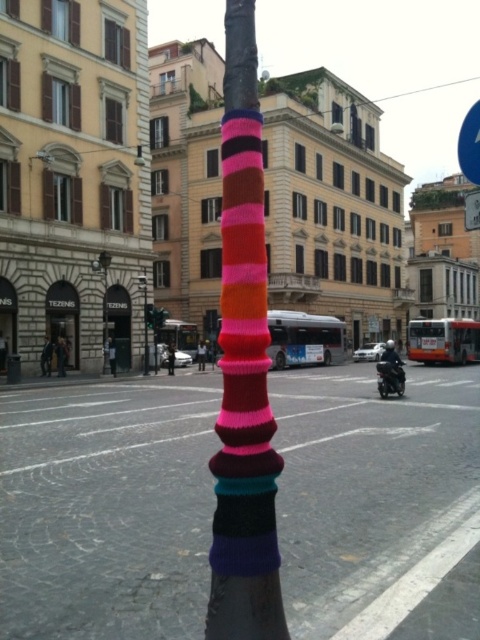
Consider the image. You are a delivery rider on a motorcycle that requires a minimum turning radius of 10 meters. You need to navigate around the metallic silver lamp post at center while staying on the same path as the shiny black motorcycle at center. Is your motorcycle able to make the turn without hitting the lamp post?

The distance between the shiny black motorcycle at center and the metallic silver lamp post at center is 16.54 meters. Since your motorcycle requires a minimum turning radius of 10 meters, the 16.54 meters distance provides sufficient space for the turn. Therefore, the motorcycle can safely navigate around the metallic silver lamp post at center without hitting it.

You are a pedestrian standing on the street and want to take a photo of the knitted yarn pole at center and the matte black lamp post at left. Which object should you focus on first to ensure both are in the frame?

You should focus on the knitted yarn pole at center first because it is in front of the matte black lamp post at left, so positioning yourself to include the foreground object will naturally include the background one as well.